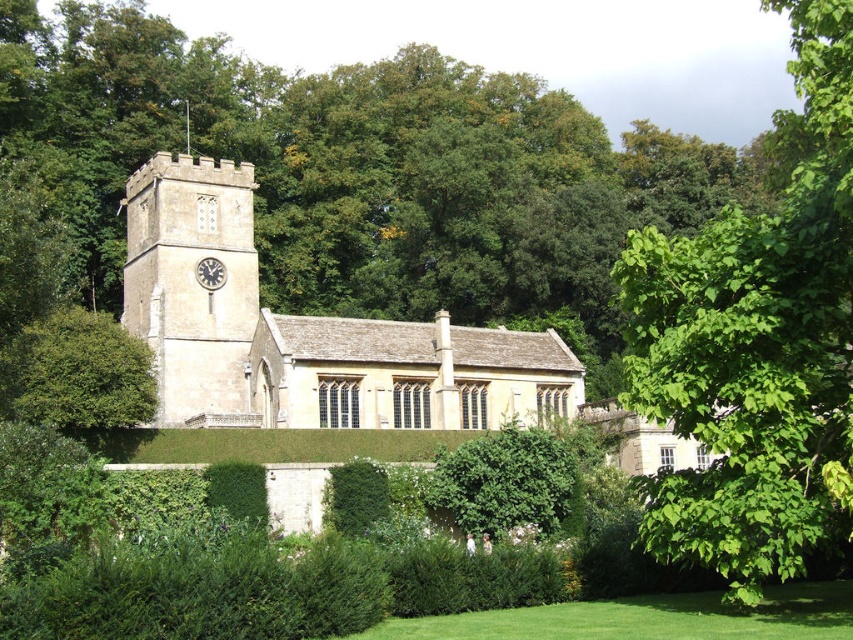
Is green leafy bush at left positioned behind green leafy bush at center?

No, it is in front of green leafy bush at center.

Is green leafy bush at left above green leafy bush at center?

Correct, green leafy bush at left is located above green leafy bush at center.

Between point (115, 346) and point (496, 524), which one is positioned in front?

Point (496, 524)

Find the location of a particular element. green leafy bush at left is located at coordinates tap(76, 372).

Does beige stone church at center come in front of green leafy bush at left?

No, it is not.

Can you confirm if beige stone church at center is positioned below green leafy bush at left?

Correct, beige stone church at center is located below green leafy bush at left.

Which is behind, point (183, 259) or point (67, 397)?

Point (183, 259)

The height and width of the screenshot is (640, 853). Find the location of `beige stone church at center`. beige stone church at center is located at coordinates (305, 332).

Who is positioned more to the right, green leafy tree at center or beige stone church at center?

green leafy tree at center is more to the right.

I want to click on green leafy tree at center, so click(x=756, y=340).